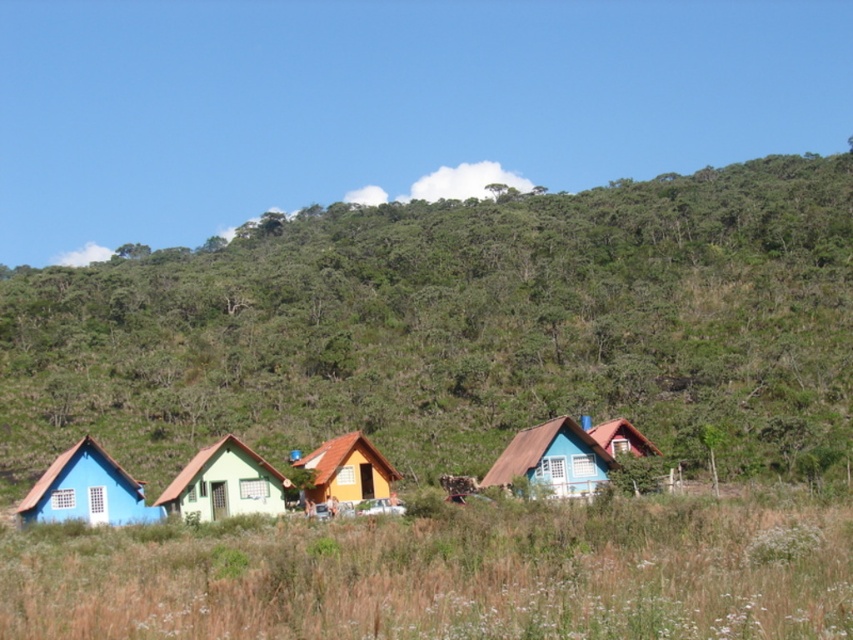
You are planning to host a small gathering and need to choose between the matte blue wooden house at lower left and the green matte house at center. Which house has more space inside for guests?

The matte blue wooden house at lower left has a larger size compared to the green matte house at center, so it has more space inside for guests.

You are standing at the camera position looking at the rural landscape with the row of colorful houses and the lush hillside. There is a point marked at coordinates point (497, 314). Can you estimate how far this point is from your current position?

The point (497, 314) is 427.72 feet away from the camera position.